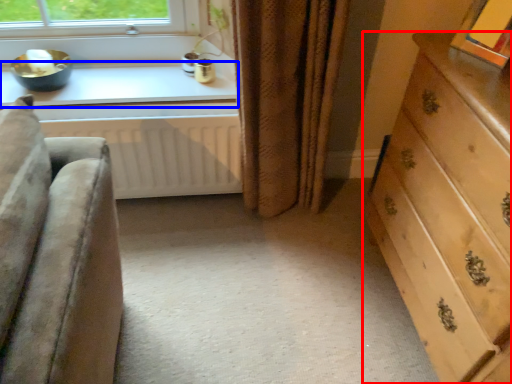
Question: Which object appears closest to the camera in this image, chest of drawers (highlighted by a red box) or window sill (highlighted by a blue box)?

Choices:
 (A) chest of drawers
 (B) window sill

Answer: (A)